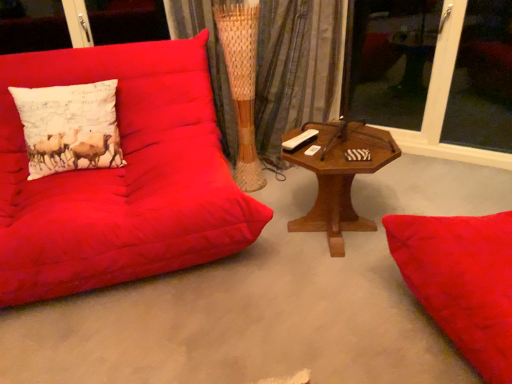
Locate an element on the screen. The image size is (512, 384). vacant space underneath woodenobject at center (from a real-world perspective) is located at coordinates (343, 231).